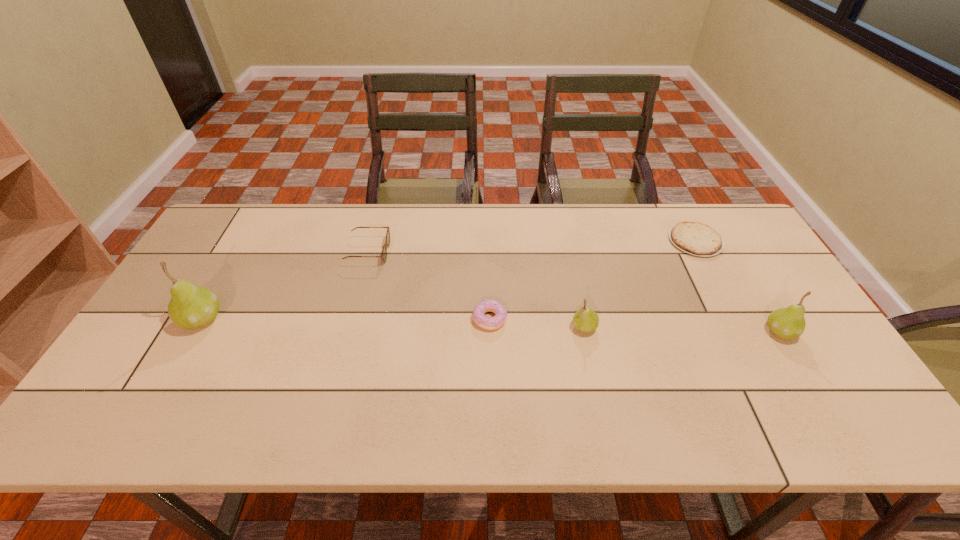
The image size is (960, 540). In order to click on pear situated at the right edge in this screenshot , I will do `click(787, 323)`.

The width and height of the screenshot is (960, 540). Find the location of `tortilla that is at the right edge`. tortilla that is at the right edge is located at coordinates (695, 238).

In order to click on object that is at the far right corner in this screenshot , I will do `click(695, 238)`.

The height and width of the screenshot is (540, 960). In the image, there is a desktop. Find the location of `vacant space at the far edge`. vacant space at the far edge is located at coordinates (482, 222).

In the image, there is a desktop. Identify the location of vacant space at the near edge. (276, 369).

In the image, there is a desktop. Identify the location of free region at the left edge. The height and width of the screenshot is (540, 960). (248, 260).

You are a GUI agent. You are given a task and a screenshot of the screen. Output one action in this format:
    pyautogui.click(x=<x>, y=<y>)
    Task: Click on the vacant space at the right edge
    The height and width of the screenshot is (540, 960).
    Given the screenshot: What is the action you would take?
    pyautogui.click(x=776, y=305)

This screenshot has height=540, width=960. In order to click on free space at the far left corner of the desktop in this screenshot , I will do `click(264, 215)`.

The image size is (960, 540). Identify the location of free region at the far right corner of the desktop. (732, 240).

The image size is (960, 540). What are the coordinates of `empty space that is in between the second tallest object and the third shortest object` in the screenshot? It's located at (574, 292).